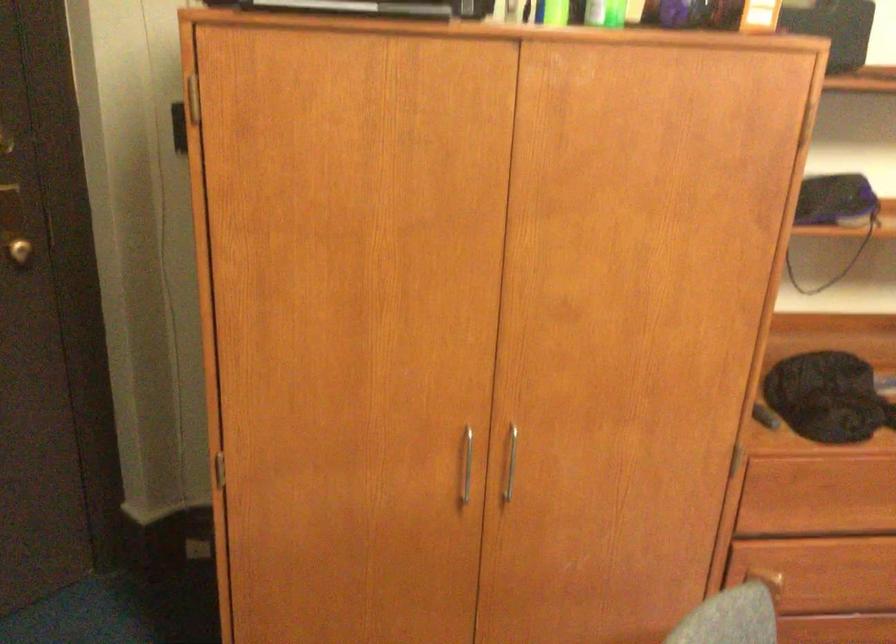
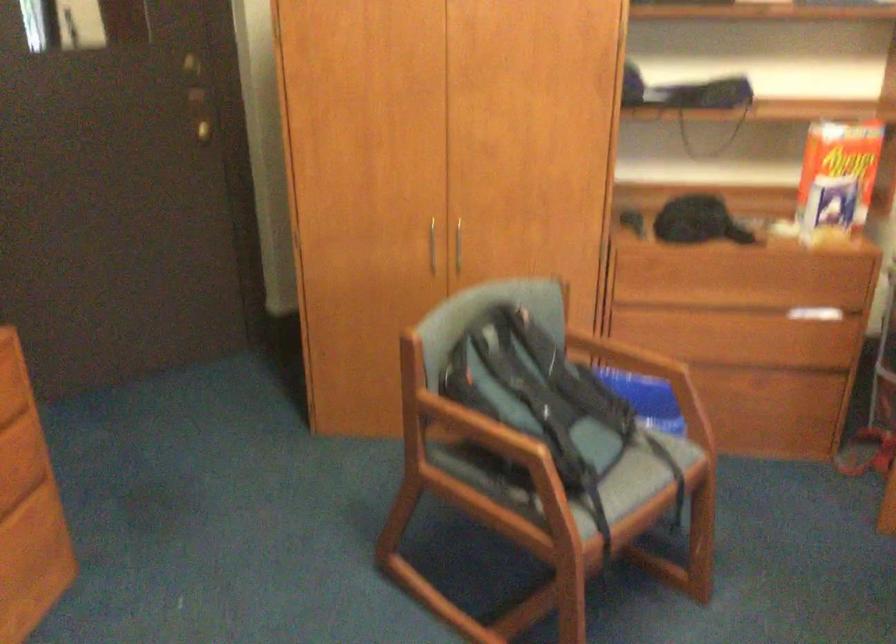
Which direction would the cameraman need to move to produce the second image?

The cameraman moved toward right, backward.